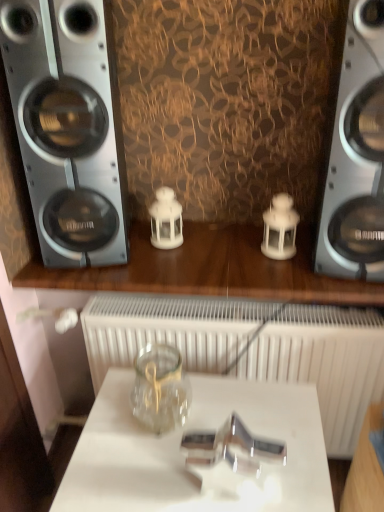
Identify the location of transparent glass jar at center. This screenshot has width=384, height=512. click(185, 456).

Image resolution: width=384 pixels, height=512 pixels. What do you see at coordinates (160, 388) in the screenshot? I see `transparent glass jar at center` at bounding box center [160, 388].

Measure the distance between metallic silver speaker at right, which is the first home appliance from right to left, and camera.

The depth of metallic silver speaker at right, which is the first home appliance from right to left, is 39.37 inches.

Image resolution: width=384 pixels, height=512 pixels. I want to click on silver metallic speaker at left, which is counted as the 2th home appliance, starting from the right, so click(x=68, y=126).

Where is `white matte radiator at center`? The width and height of the screenshot is (384, 512). white matte radiator at center is located at coordinates (324, 362).

Find the location of `transparent glass jar at center`. transparent glass jar at center is located at coordinates (185, 456).

Does point (151, 341) come behind point (318, 476)?

That is True.

Who is shorter, white matte radiator at center or transparent glass jar at center?

Standing shorter between the two is transparent glass jar at center.

Can we say white matte radiator at center lies outside transparent glass jar at center?

Indeed, white matte radiator at center is completely outside transparent glass jar at center.

Identify the location of table located in front of the white matte radiator at center. Image resolution: width=384 pixels, height=512 pixels. (185, 456).

Do you think transparent glass jar at center is within white matte radiator at center, or outside of it?

transparent glass jar at center is not enclosed by white matte radiator at center.

Can you confirm if transparent glass jar at center is smaller than white matte radiator at center?

Yes, transparent glass jar at center is smaller than white matte radiator at center.

Looking at this image, from a real-world perspective, does transparent glass jar at center sit lower than white matte radiator at center?

Yes, from a real-world perspective, transparent glass jar at center is below white matte radiator at center.

Which object is thinner, transparent glass jar at center or white matte radiator at center?

With smaller width is transparent glass jar at center.

In the image, is transparent glass jar at center positioned in front of or behind transparent glass jar at center?

transparent glass jar at center is behind transparent glass jar at center.

Visually, is transparent glass jar at center positioned to the left or to the right of transparent glass jar at center?

transparent glass jar at center is positioned on transparent glass jar at center's left side.

Does point (135, 372) lie behind point (196, 420)?

That is True.

Which of these two, transparent glass jar at center or transparent glass jar at center, stands shorter?

transparent glass jar at center.

Is silver metallic speaker at left, which is counted as the 2th home appliance, starting from the right, facing away from transparent glass jar at center?

No, transparent glass jar at center is not at the back of silver metallic speaker at left, which is counted as the 2th home appliance, starting from the right.

Considering the points (60, 11) and (182, 401), which point is behind, point (60, 11) or point (182, 401)?

Positioned behind is point (182, 401).

Considering the positions of objects silver metallic speaker at left, which is counted as the 2th home appliance, starting from the right, and transparent glass jar at center in the image provided, who is in front, silver metallic speaker at left, which is counted as the 2th home appliance, starting from the right, or transparent glass jar at center?

transparent glass jar at center is in front.

Which of these two, silver metallic speaker at left, which is counted as the 2th home appliance, starting from the right, or transparent glass jar at center, is bigger?

Bigger between the two is silver metallic speaker at left, which is counted as the 2th home appliance, starting from the right.

Can you tell me how much silver metallic speaker at left, which is counted as the 2th home appliance, starting from the right, and white matte radiator at center differ in facing direction?

10.2 degrees.

Would you say silver metallic speaker at left, placed as the 1th home appliance when sorted from left to right, is outside white matte radiator at center?

Absolutely, silver metallic speaker at left, placed as the 1th home appliance when sorted from left to right, is external to white matte radiator at center.

From a real-world perspective, is silver metallic speaker at left, placed as the 1th home appliance when sorted from left to right, physically below white matte radiator at center?

No, from a real-world perspective, silver metallic speaker at left, placed as the 1th home appliance when sorted from left to right, is not below white matte radiator at center.

From the image's perspective, is silver metallic speaker at left, which is counted as the 2th home appliance, starting from the right, over white matte radiator at center?

Correct, silver metallic speaker at left, which is counted as the 2th home appliance, starting from the right, appears higher than white matte radiator at center in the image.

Between metallic silver speaker at right, placed as the second home appliance when sorted from left to right, and white matte radiator at center, which one has larger width?

Wider between the two is white matte radiator at center.

From the picture: Does metallic silver speaker at right, which is the first home appliance from right to left, turn towards white matte radiator at center?

No, metallic silver speaker at right, which is the first home appliance from right to left, is not aimed at white matte radiator at center.

Which of these two, metallic silver speaker at right, which is the first home appliance from right to left, or white matte radiator at center, stands taller?

metallic silver speaker at right, which is the first home appliance from right to left, is taller.

From a real-world perspective, is white matte radiator at center located beneath metallic silver speaker at right, which is the first home appliance from right to left?

Indeed, from a real-world perspective, white matte radiator at center is positioned beneath metallic silver speaker at right, which is the first home appliance from right to left.

Find the location of a particular element. the 1st home appliance directly above the white matte radiator at center (from a real-world perspective) is located at coordinates (356, 155).

Who is smaller, white matte radiator at center or metallic silver speaker at right, placed as the second home appliance when sorted from left to right?

Smaller between the two is metallic silver speaker at right, placed as the second home appliance when sorted from left to right.

Is white matte radiator at center facing away from metallic silver speaker at right, placed as the second home appliance when sorted from left to right?

white matte radiator at center is not turned away from metallic silver speaker at right, placed as the second home appliance when sorted from left to right.

Where is `radiator on the right of transparent glass jar at center`? The height and width of the screenshot is (512, 384). radiator on the right of transparent glass jar at center is located at coordinates (324, 362).

You are a GUI agent. You are given a task and a screenshot of the screen. Output one action in this format:
    pyautogui.click(x=<x>, y=<y>)
    Task: Click on the table below the white matte radiator at center (from the image's perspective)
    This screenshot has height=512, width=384.
    Given the screenshot: What is the action you would take?
    pyautogui.click(x=185, y=456)

From the image, which object appears to be farther from white matte radiator at center, transparent glass jar at center or silver metallic speaker at left, which is counted as the 2th home appliance, starting from the right?

Based on the image, silver metallic speaker at left, which is counted as the 2th home appliance, starting from the right, appears to be further to white matte radiator at center.

Based on their spatial positions, is transparent glass jar at center or metallic silver speaker at right, which is the first home appliance from right to left, closer to white matte radiator at center?

transparent glass jar at center lies closer to white matte radiator at center than the other object.

Based on their spatial positions, is white matte radiator at center or silver metallic speaker at left, placed as the 1th home appliance when sorted from left to right, closer to transparent glass jar at center?

The object closer to transparent glass jar at center is white matte radiator at center.

Considering their positions, is white matte radiator at center positioned closer to silver metallic speaker at left, which is counted as the 2th home appliance, starting from the right, than transparent glass jar at center?

Among the two, white matte radiator at center is located nearer to silver metallic speaker at left, which is counted as the 2th home appliance, starting from the right.

When comparing their distances from transparent glass jar at center, does transparent glass jar at center or metallic silver speaker at right, which is the first home appliance from right to left, seem closer?

Based on the image, transparent glass jar at center appears to be nearer to transparent glass jar at center.

When comparing their distances from white matte radiator at center, does metallic silver speaker at right, which is the first home appliance from right to left, or transparent glass jar at center seem closer?

transparent glass jar at center is closer to white matte radiator at center.

Which object lies further to the anchor point metallic silver speaker at right, placed as the second home appliance when sorted from left to right, silver metallic speaker at left, placed as the 1th home appliance when sorted from left to right, or white matte radiator at center?

silver metallic speaker at left, placed as the 1th home appliance when sorted from left to right, lies further to metallic silver speaker at right, placed as the second home appliance when sorted from left to right, than the other object.

When comparing their distances from white matte radiator at center, does metallic silver speaker at right, placed as the second home appliance when sorted from left to right, or silver metallic speaker at left, placed as the 1th home appliance when sorted from left to right, seem closer?

metallic silver speaker at right, placed as the second home appliance when sorted from left to right, lies closer to white matte radiator at center than the other object.

Where is `glass jar between metallic silver speaker at right, which is the first home appliance from right to left, and transparent glass jar at center, in the vertical direction`? Image resolution: width=384 pixels, height=512 pixels. glass jar between metallic silver speaker at right, which is the first home appliance from right to left, and transparent glass jar at center, in the vertical direction is located at coordinates (160, 388).

At what (x,y) coordinates should I click in order to perform the action: click on radiator between metallic silver speaker at right, which is the first home appliance from right to left, and transparent glass jar at center vertically. Please return your answer as a coordinate pair (x, y). This screenshot has height=512, width=384. Looking at the image, I should click on (324, 362).

I want to click on radiator between silver metallic speaker at left, which is counted as the 2th home appliance, starting from the right, and transparent glass jar at center, in the vertical direction, so click(324, 362).

Locate an element on the screen. The height and width of the screenshot is (512, 384). glass jar that lies between silver metallic speaker at left, which is counted as the 2th home appliance, starting from the right, and transparent glass jar at center from top to bottom is located at coordinates (160, 388).